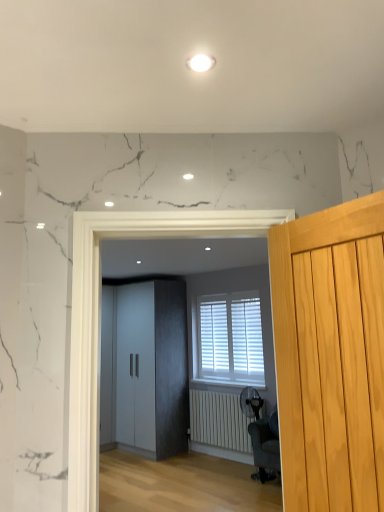
Question: Is white matte radiator at lower center directly adjacent to white matte cabinet at center?

Choices:
 (A) yes
 (B) no

Answer: (B)

Question: From a real-world perspective, is white matte radiator at lower center located beneath white matte cabinet at center?

Choices:
 (A) yes
 (B) no

Answer: (A)

Question: Is white matte radiator at lower center positioned with its back to white matte cabinet at center?

Choices:
 (A) yes
 (B) no

Answer: (B)

Question: Is white matte cabinet at center a part of white matte radiator at lower center?

Choices:
 (A) no
 (B) yes

Answer: (A)

Question: Can you confirm if white matte radiator at lower center is bigger than white matte cabinet at center?

Choices:
 (A) no
 (B) yes

Answer: (A)

Question: Is light wood door at right in front of or behind white matte blinds at center in the image?

Choices:
 (A) front
 (B) behind

Answer: (A)

Question: Is light wood door at right taller or shorter than white matte blinds at center?

Choices:
 (A) tall
 (B) short

Answer: (B)

Question: From a real-world perspective, is light wood door at right physically located above or below white matte blinds at center?

Choices:
 (A) below
 (B) above

Answer: (B)

Question: Considering the relative positions of light wood door at right and white matte blinds at center in the image provided, is light wood door at right to the left or to the right of white matte blinds at center?

Choices:
 (A) right
 (B) left

Answer: (B)

Question: Is matte gray wardrobe at center in front of or behind white matte radiator at lower center in the image?

Choices:
 (A) behind
 (B) front

Answer: (B)

Question: Considering the positions of point coord(96,243) and point coord(201,402), is point coord(96,243) closer or farther from the camera than point coord(201,402)?

Choices:
 (A) farther
 (B) closer

Answer: (B)

Question: Do you think matte gray wardrobe at center is within white matte radiator at lower center, or outside of it?

Choices:
 (A) inside
 (B) outside

Answer: (B)

Question: Is matte gray wardrobe at center taller or shorter than white matte radiator at lower center?

Choices:
 (A) tall
 (B) short

Answer: (A)

Question: Is point (82, 232) closer or farther from the camera than point (276, 418)?

Choices:
 (A) closer
 (B) farther

Answer: (A)

Question: Is matte gray wardrobe at center wider or thinner than dark gray fabric swivel chair at center?

Choices:
 (A) wide
 (B) thin

Answer: (B)